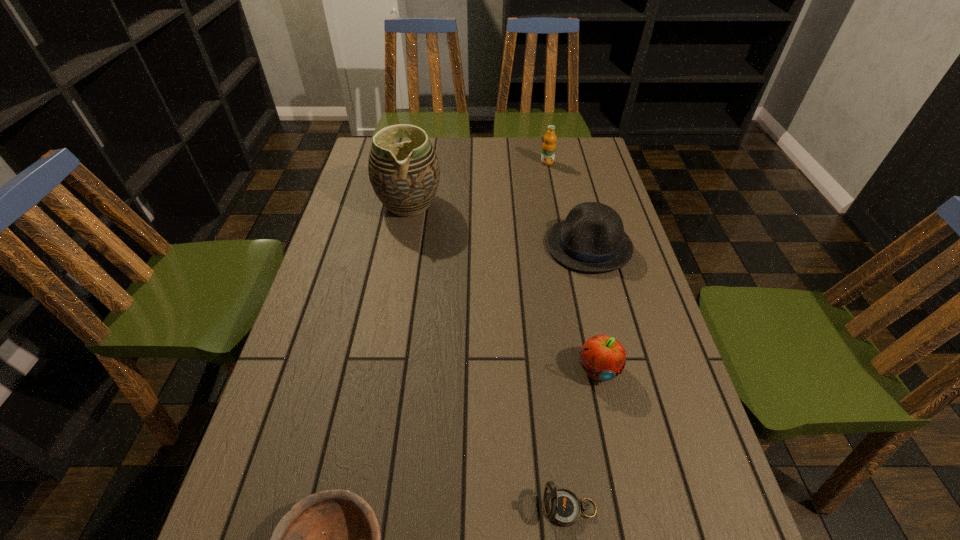
Locate an element on the screen. The width and height of the screenshot is (960, 540). the tallest object is located at coordinates (405, 176).

Where is `orange juice`? orange juice is located at coordinates (549, 145).

The height and width of the screenshot is (540, 960). Identify the location of bowler hat. (591, 239).

At what (x,y) coordinates should I click in order to perform the action: click on apple. Please return your answer as a coordinate pair (x, y). Looking at the image, I should click on (602, 357).

Identify the location of the second shortest object. The height and width of the screenshot is (540, 960). (562, 506).

The height and width of the screenshot is (540, 960). In order to click on free spot located 0.100m on the back of the pottery in this screenshot , I will do `click(416, 169)`.

Locate an element on the screen. This screenshot has height=540, width=960. vacant region located 0.300m on the label of the orange juice is located at coordinates (559, 218).

This screenshot has height=540, width=960. In order to click on vacant area situated on the front-facing side of the bowler hat in this screenshot , I will do `click(511, 245)`.

Where is `vacant area situated on the front-facing side of the bowler hat`? vacant area situated on the front-facing side of the bowler hat is located at coordinates (521, 245).

At what (x,y) coordinates should I click in order to perform the action: click on vacant position located 0.390m on the front-facing side of the bowler hat. Please return your answer as a coordinate pair (x, y). Looking at the image, I should click on (411, 245).